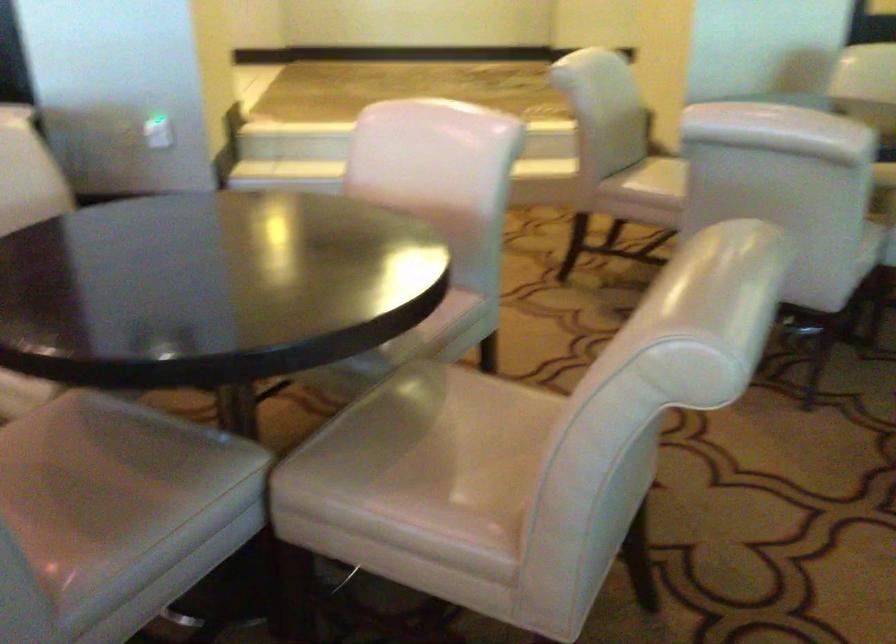
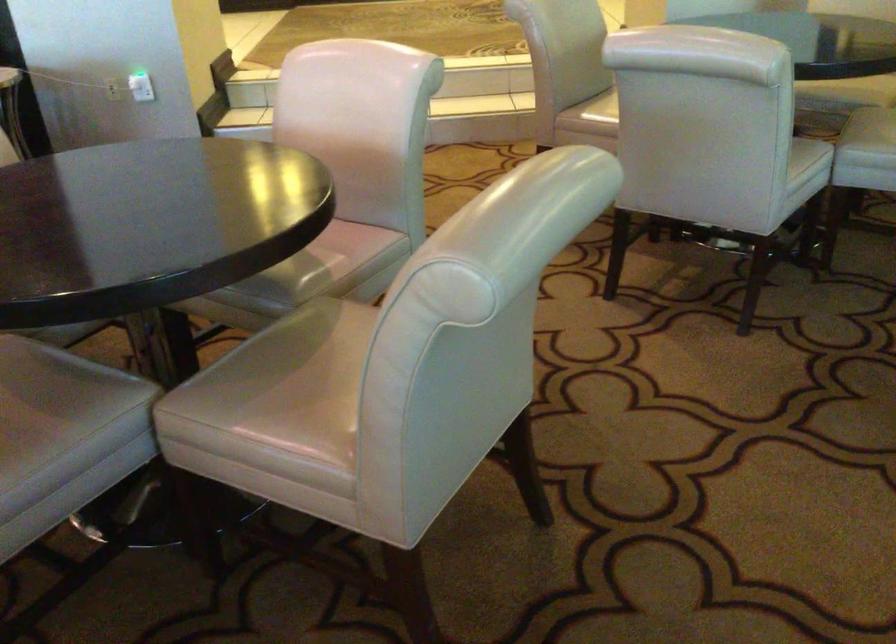
Question: What movement of the cameraman would produce the second image?

Choices:
 (A) Left
 (B) Right
 (C) Forward
 (D) Backward

Answer: (B)